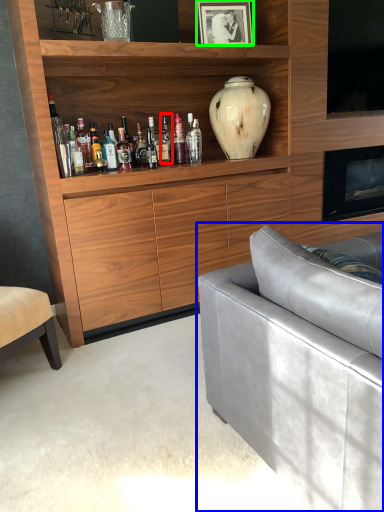
Question: Which is farther away from bottle (highlighted by a red box)? studio couch (highlighted by a blue box) or picture frame (highlighted by a green box)?

Choices:
 (A) studio couch
 (B) picture frame

Answer: (A)